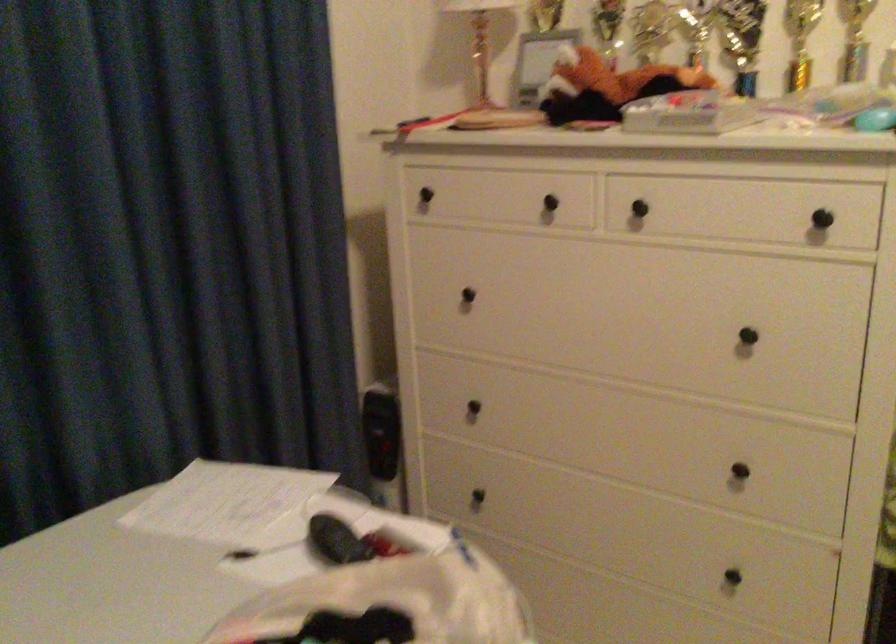
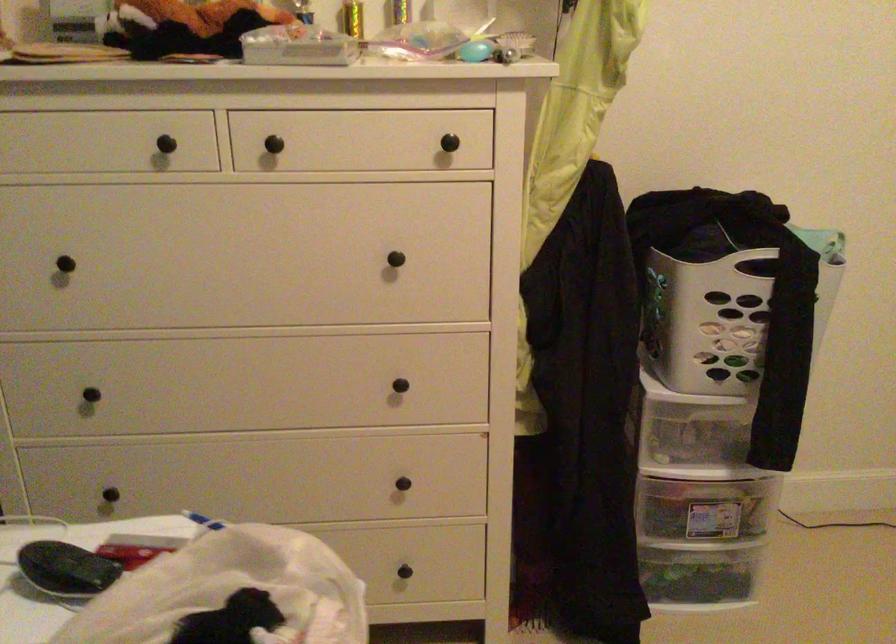
Find the pixel in the second image that matches [756,343] in the first image.

(400, 261)